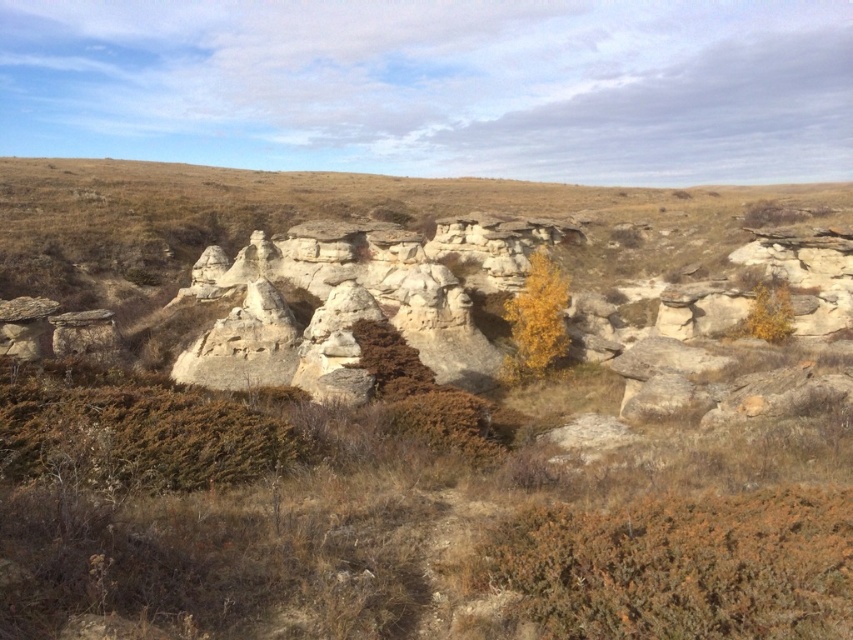
Can you confirm if white sandstone rock formation at center is positioned above yellow leafy tree at center?

Yes, white sandstone rock formation at center is above yellow leafy tree at center.

Is white sandstone rock formation at center thinner than yellow leafy tree at center?

Incorrect, white sandstone rock formation at center's width is not less than yellow leafy tree at center's.

Which is behind, point (462, 352) or point (525, 323)?

Point (525, 323)

Image resolution: width=853 pixels, height=640 pixels. In order to click on white sandstone rock formation at center in this screenshot , I will do `click(357, 298)`.

Can you confirm if yellow leafy tree at center is shorter than yellow leafy tree at center-right?

No, yellow leafy tree at center is not shorter than yellow leafy tree at center-right.

Is the position of yellow leafy tree at center more distant than that of yellow leafy tree at center-right?

No.

Measure the distance between yellow leafy tree at center and camera.

The distance of yellow leafy tree at center from camera is 256.27 feet.

The height and width of the screenshot is (640, 853). What are the coordinates of `yellow leafy tree at center` in the screenshot? It's located at (537, 321).

Looking at this image, is white sandstone rock formation at center above yellow leafy tree at center-right?

Correct, white sandstone rock formation at center is located above yellow leafy tree at center-right.

Which is more to the left, white sandstone rock formation at center or yellow leafy tree at center-right?

white sandstone rock formation at center

Is point (289, 342) closer to camera compared to point (784, 324)?

Yes, it is in front of point (784, 324).

Locate an element on the screen. white sandstone rock formation at center is located at coordinates (357, 298).